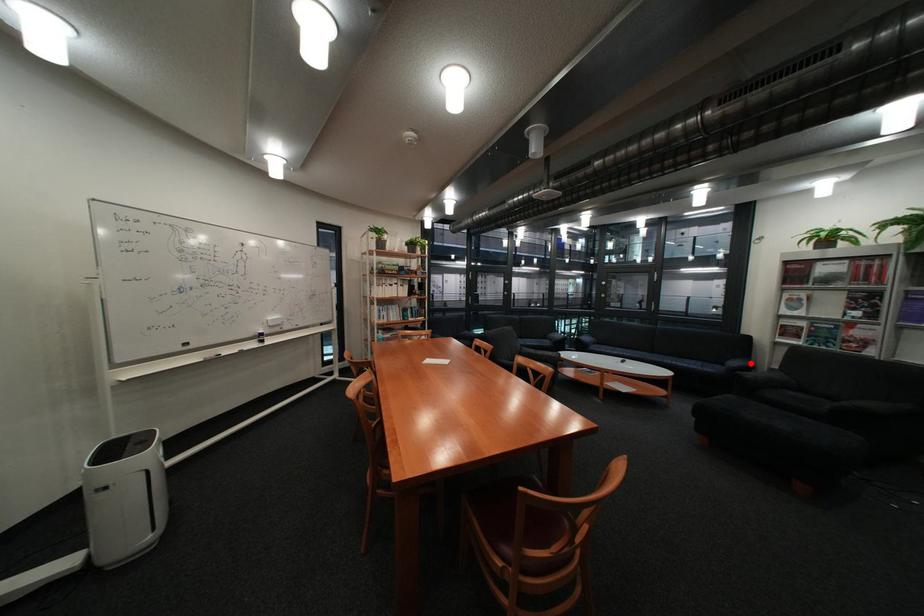
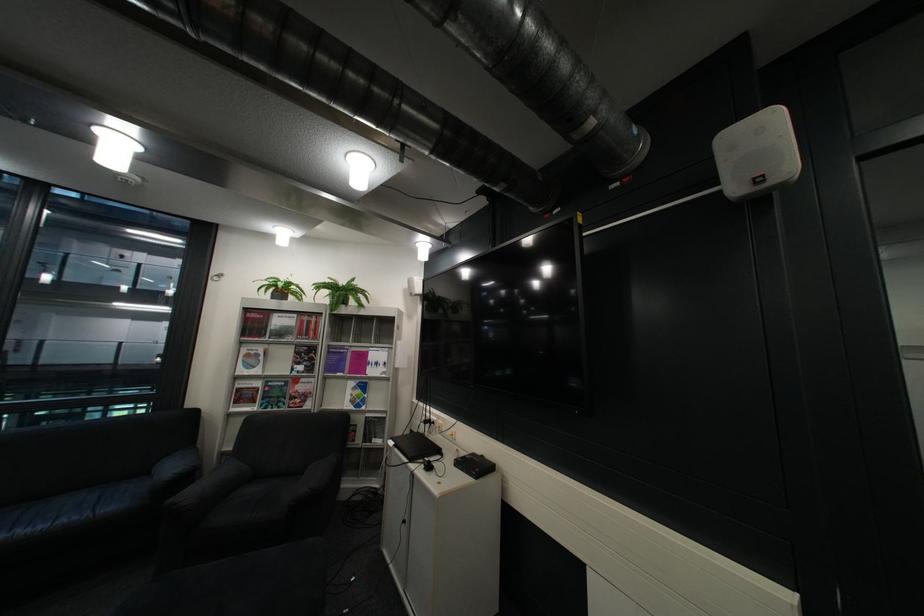
Locate, in the second image, the point that corresponds to the highlighted location in the first image.

(186, 468)